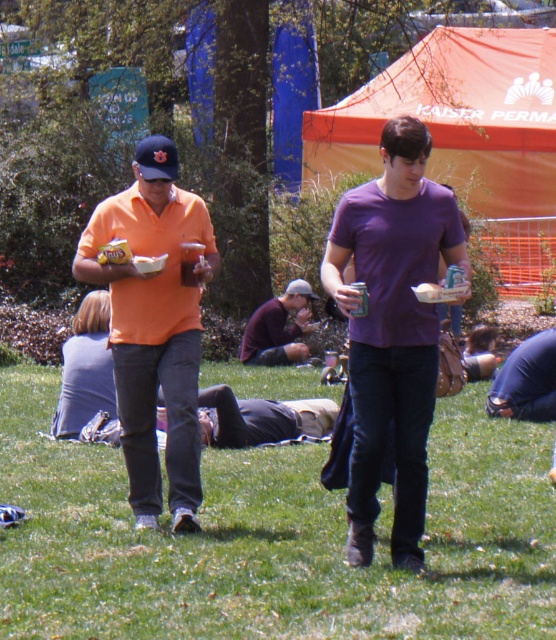
Consider the image. You are standing at the edge of the park and see the green grass at center and the dark purple shirt at center. If you want to reach both locations, which one is closer to you?

The dark purple shirt at center is closer to you since it is only 10.95 meters away from the green grass at center, but without knowing your exact starting position, we can only compare their distance relative to each other. However, since both are at the center, you might be equidistant to both if you are at the edge directly opposite the center. But according to the description, the green grass is 10.95 meters from the dark purple shirt, so if you are at the edge, the closer one would depend on which side

You are planning to lay down a picnic blanket on the green grass at center. Considering the space available, will the dark purple shirt at center interfere with your picnic area?

The green grass at center is narrower than the dark purple shirt at center, so the dark purple shirt at center might be occupying more space, potentially interfering with your picnic area.

You are standing at the origin point in the image. The matte orange shirt at center is at coordinates 0.509, 0.279. If you want to walk directly towards it, which direction should you head?

You should head towards the coordinates (155, 324) to reach the matte orange shirt at center.